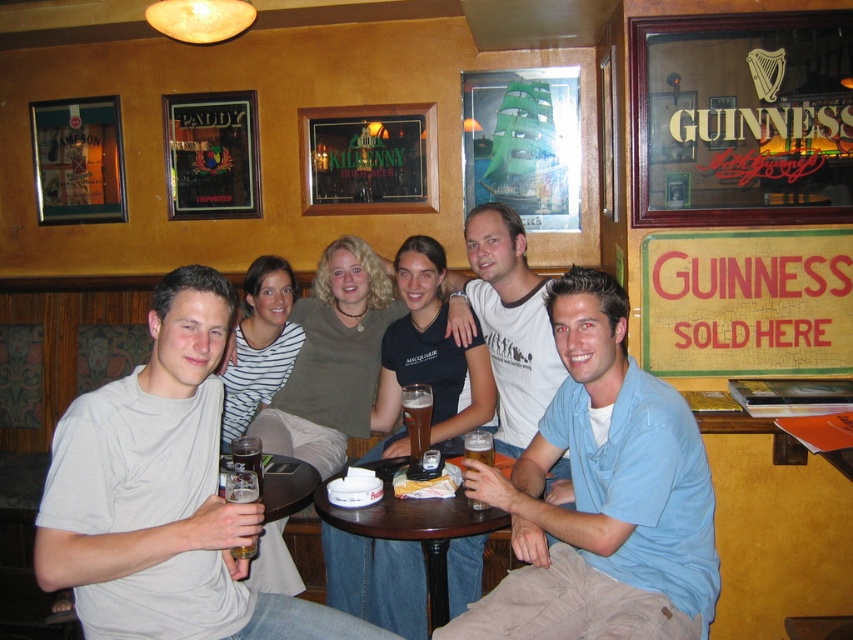
You are a bartender who needs to place a new drink order for the table. The drink must be placed between the blue cotton shirt at center and the brown glass beer at center. The minimum distance required between items on the table is 15 inches. Can you place the new drink there?

The blue cotton shirt at center and brown glass beer at center are 22.07 inches apart from each other. Since the minimum distance required is 15 inches, the new drink can be placed between them as there is sufficient space.

You are standing at the entrance of the pub and want to locate the brown wooden table at center. According to the coordinates provided, where would you find it?

The brown wooden table at center is located at point (401, 556).